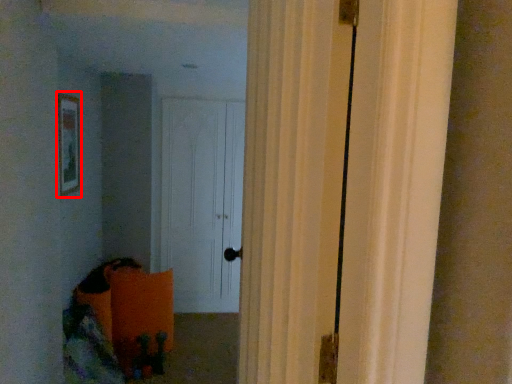
Question: Where is picture frame (annotated by the red box) located in relation to door in the image?

Choices:
 (A) left
 (B) right

Answer: (A)